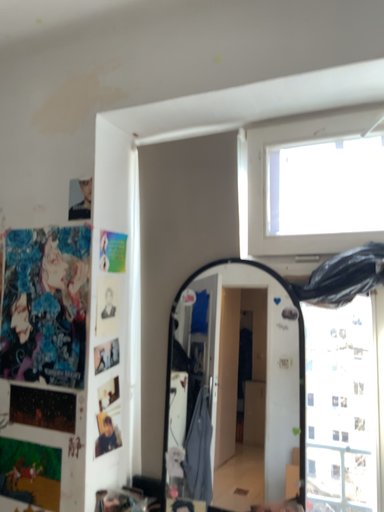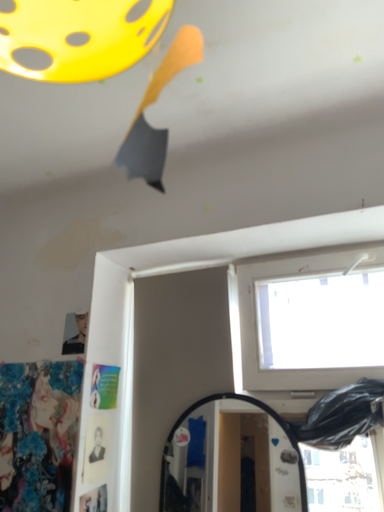
Question: How did the camera likely rotate when shooting the video?

Choices:
 (A) rotated downward
 (B) rotated upward

Answer: (B)